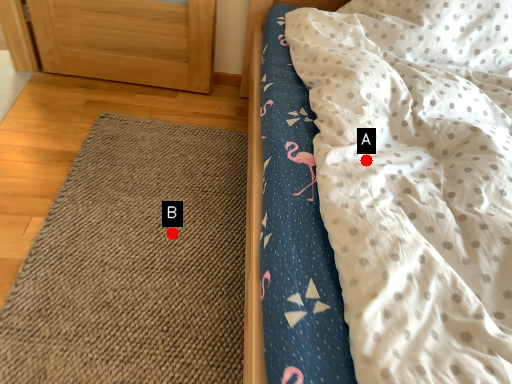
Question: Two points are circled on the image, labeled by A and B beside each circle. Which point is further to the camera?

Choices:
 (A) A is further
 (B) B is further

Answer: (B)